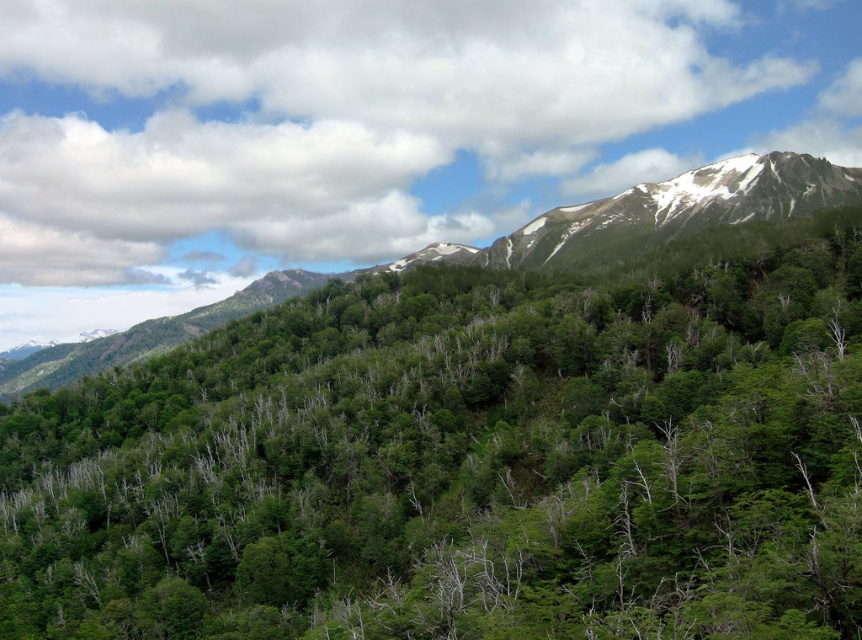
You are a hiker planning to take a photo of the green leafy tree at center and the green leafy forest at upper center. Which one would appear closer to the camera in your photo?

The green leafy tree at center appears closer to the camera because it is smaller in size compared to the green leafy forest at upper center, which suggests it is farther away.

You are a hiker standing at the base of the mountain and see the green leafy tree at center and the green leafy forest at upper center. Which object is closer to you?

The green leafy tree at center is closer to you because it is 134.56 meters away from the green leafy forest at upper center, meaning the tree is nearer to your position at the base of the mountain.